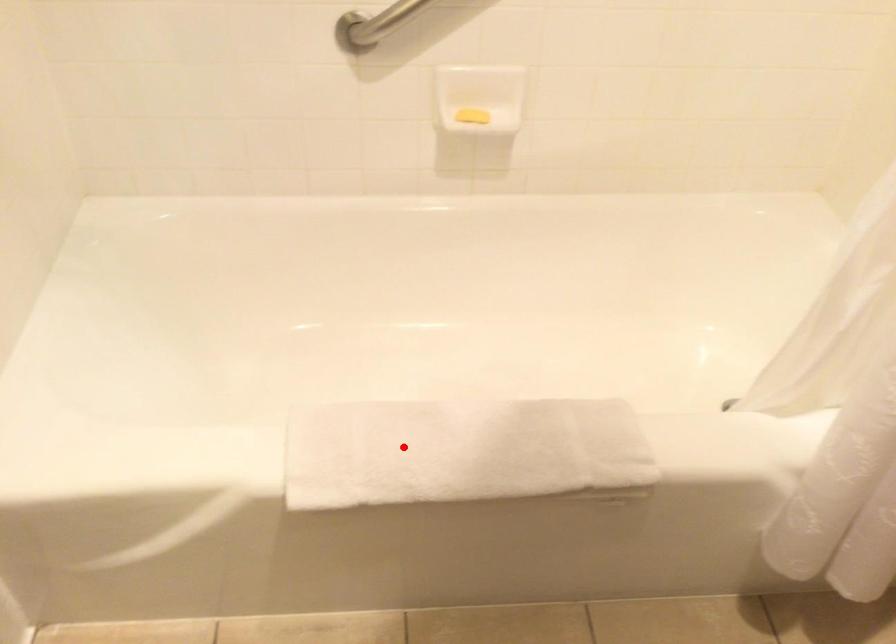
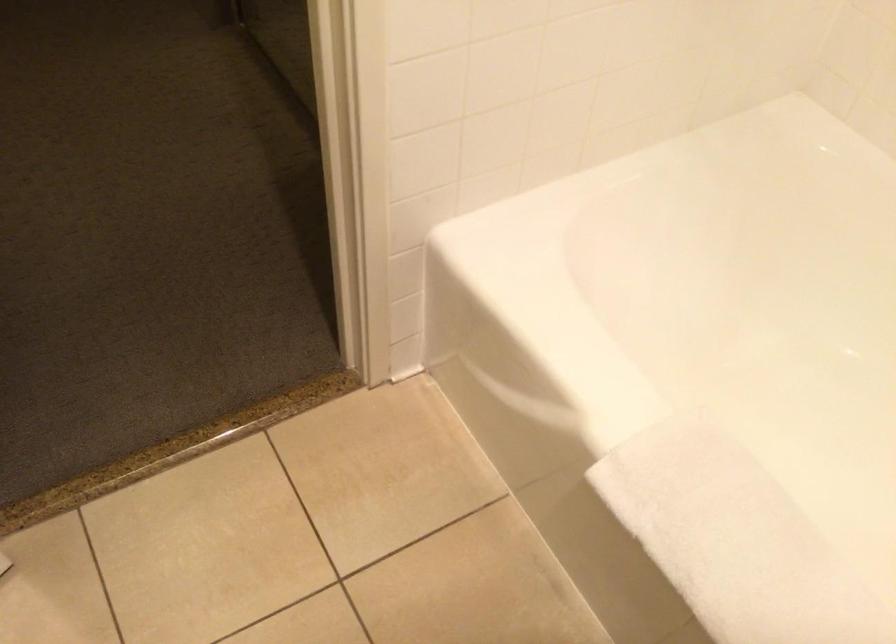
Where in the second image is the point corresponding to the highlighted location from the first image?

(736, 541)